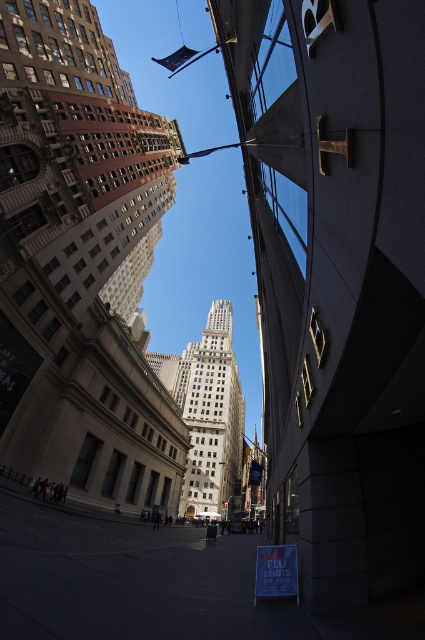
You are standing on the street looking up at the buildings. Which of the two towers, the brown stone skyscraper at center or the white marble tower at center, is located to the left side?

The brown stone skyscraper at center is positioned on the left side of the white marble tower at center, so it is located to the left side.

You are standing on the street looking up at the buildings. Which of the two structures, the dark gray concrete skyscraper at center or the white marble tower at center, appears higher in the image?

The dark gray concrete skyscraper at center appears higher in the image as it is positioned above the white marble tower at center.